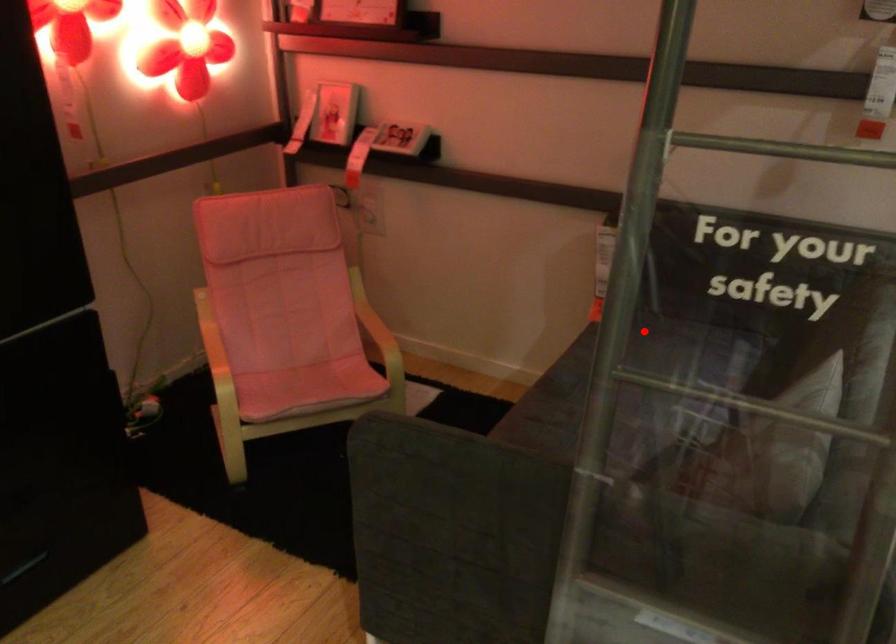
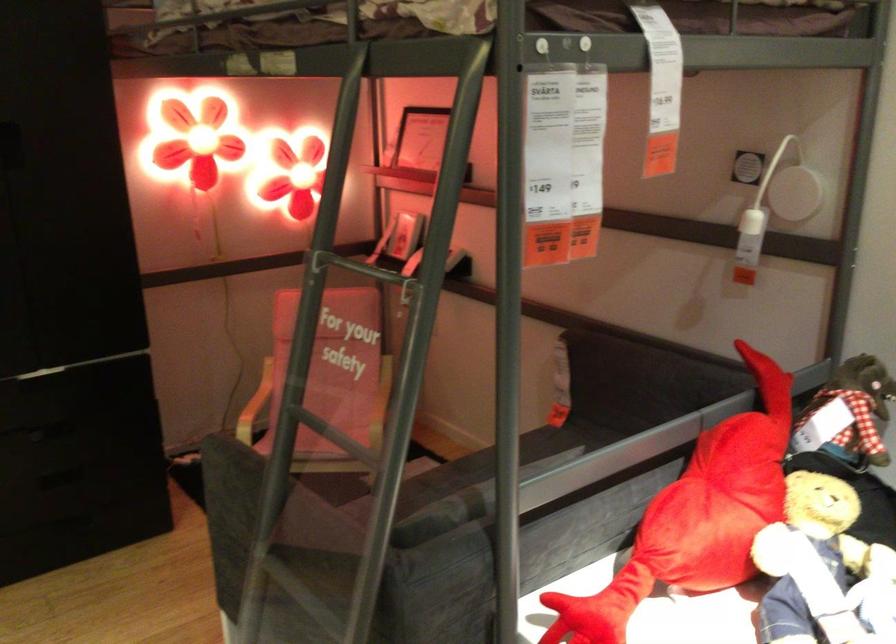
The point at the highlighted location is marked in the first image. Where is the corresponding point in the second image?

(567, 437)